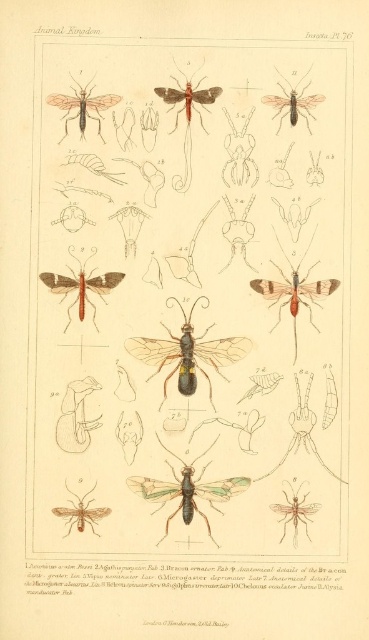
Question: Which point is farther to the camera?

Choices:
 (A) (315, 324)
 (B) (295, 515)

Answer: (A)

Question: Where is translucent amber wings at center located in relation to translucent beige moth at upper left in the image?

Choices:
 (A) left
 (B) right

Answer: (B)

Question: Which point is closer to the camera taking this photo?

Choices:
 (A) (225, 356)
 (B) (84, 301)

Answer: (B)

Question: Which point appears farthest from the camera in this image?

Choices:
 (A) (198, 148)
 (B) (76, 106)
 (C) (305, 522)

Answer: (A)

Question: In this image, where is matte brown moth at center located relative to translucent amber insect at lower right?

Choices:
 (A) right
 (B) left

Answer: (B)

Question: Does translucent green insect at center appear under green translucent wings at center?

Choices:
 (A) yes
 (B) no

Answer: (B)